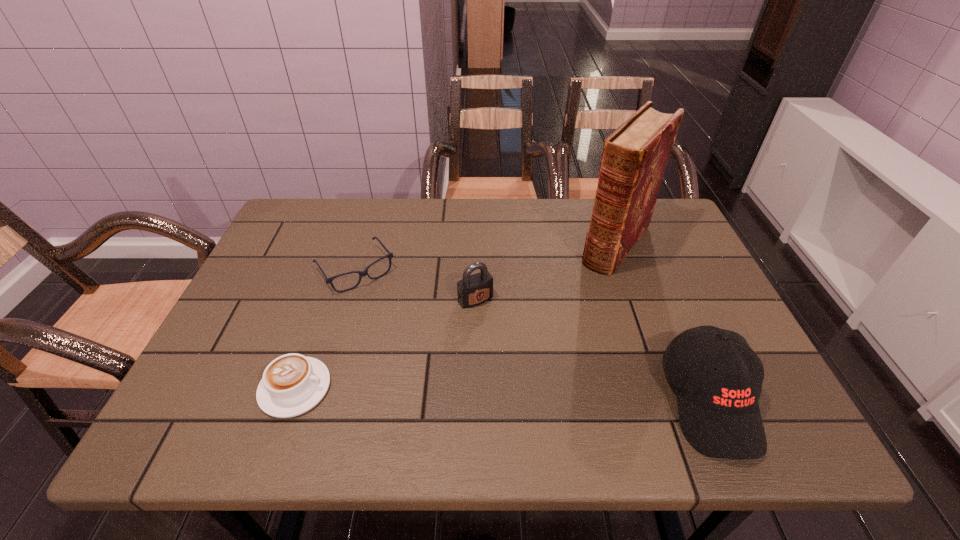
At what (x,y) coordinates should I click in order to perform the action: click on vacant area situated on the front of the third object from right to left near the keyhole. Please return your answer as a coordinate pair (x, y). Looking at the image, I should click on (510, 342).

The height and width of the screenshot is (540, 960). In order to click on free space located on the front of the third object from right to left near the keyhole in this screenshot , I will do `click(541, 385)`.

Locate an element on the screen. This screenshot has height=540, width=960. vacant space located on the spine side of the hardback book is located at coordinates (543, 343).

At what (x,y) coordinates should I click in order to perform the action: click on free region located on the spine side of the hardback book. Please return your answer as a coordinate pair (x, y). This screenshot has height=540, width=960. Looking at the image, I should click on point(581,295).

Where is `vacant space positioned on the spine side of the hardback book`? This screenshot has width=960, height=540. vacant space positioned on the spine side of the hardback book is located at coordinates (562, 319).

Locate an element on the screen. The height and width of the screenshot is (540, 960). spectacles present at the far edge is located at coordinates (361, 273).

What are the coordinates of `hardback book at the far edge` in the screenshot? It's located at (634, 158).

Find the location of `cappuccino present at the near edge`. cappuccino present at the near edge is located at coordinates [x=292, y=384].

This screenshot has height=540, width=960. Identify the location of baseball cap that is at the near edge. (719, 414).

Locate an element on the screen. cappuccino located in the left edge section of the desktop is located at coordinates (292, 384).